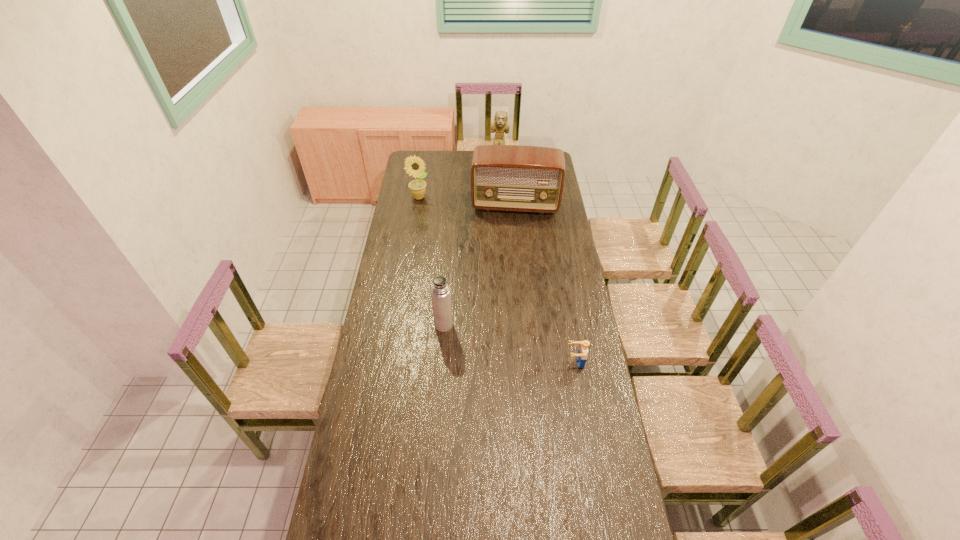
Image resolution: width=960 pixels, height=540 pixels. I want to click on object at the far edge, so click(500, 124).

I want to click on object positioned at the left edge, so click(415, 166).

Identify the location of Lego that is at the right edge. This screenshot has height=540, width=960. (581, 357).

Find the location of a particular element. This screenshot has height=540, width=960. radio receiver at the right edge is located at coordinates (521, 178).

Where is `vacant space at the far edge`? Image resolution: width=960 pixels, height=540 pixels. vacant space at the far edge is located at coordinates (468, 156).

Locate an element on the screen. The width and height of the screenshot is (960, 540). free space at the near edge is located at coordinates (398, 500).

In the image, there is a desktop. Find the location of `vacant space at the left edge`. vacant space at the left edge is located at coordinates (410, 317).

The width and height of the screenshot is (960, 540). In the image, there is a desktop. In order to click on blank space at the right edge in this screenshot , I will do `click(586, 368)`.

In the image, there is a desktop. Where is `vacant space at the far left corner`? This screenshot has height=540, width=960. vacant space at the far left corner is located at coordinates (415, 154).

At what (x,y) coordinates should I click in order to perform the action: click on vacant region between the figurine and the second object from left to right. Please return your answer as a coordinate pair (x, y). The image size is (960, 540). Looking at the image, I should click on (471, 244).